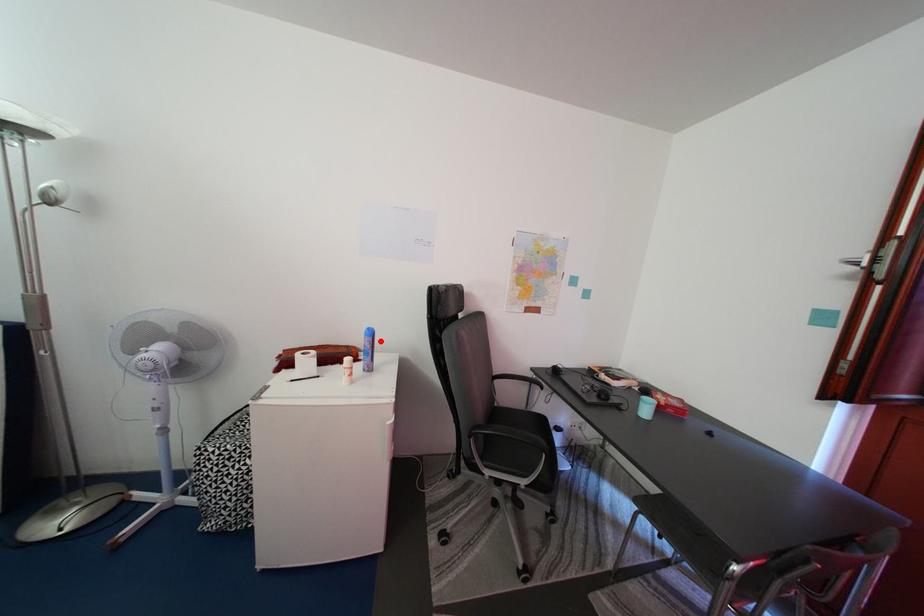
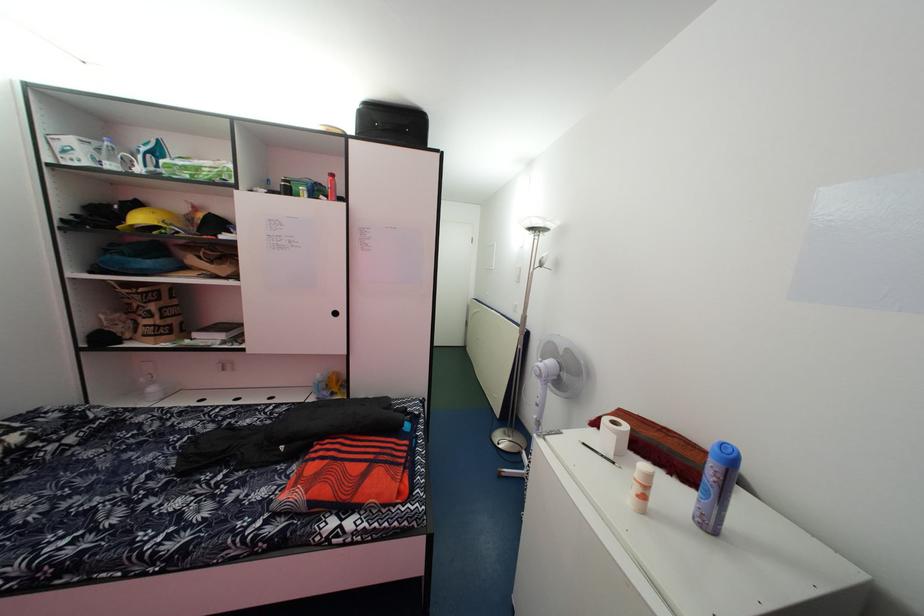
Question: A red point is marked in image1. In image2, is the corresponding 3D point closer to the camera or farther? Reply with the corresponding letter.

Choices:
 (A) The corresponding 3D point is closer.
 (B) The corresponding 3D point is farther.

Answer: (A)